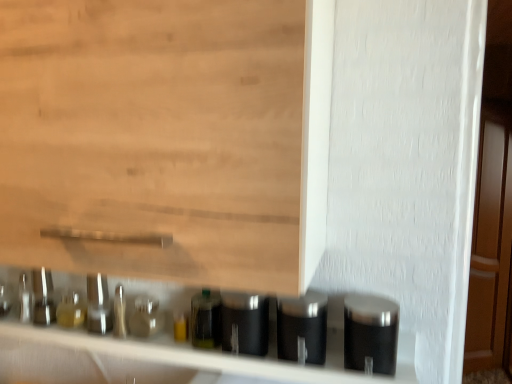
I want to click on free space that is to the left of translucent glass bottle at center, so click(x=145, y=347).